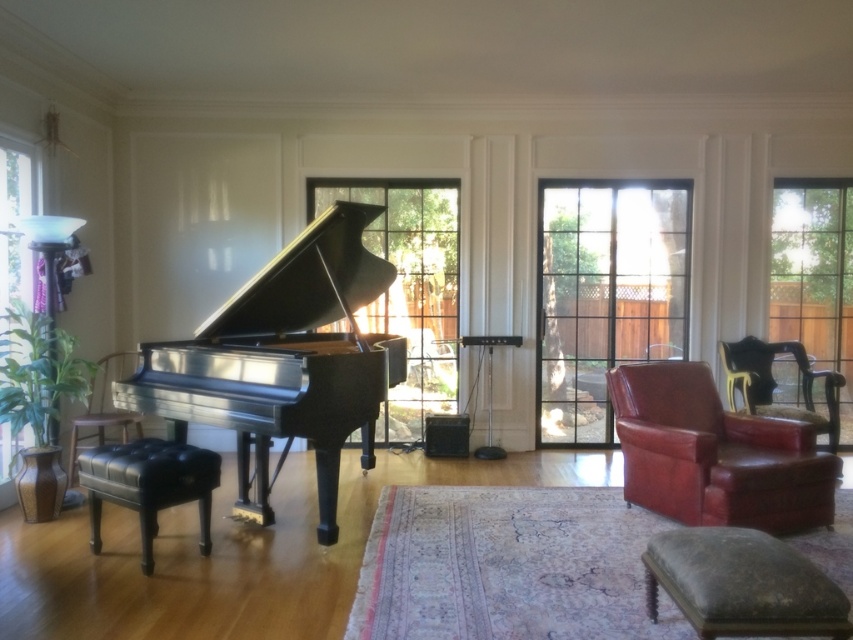
Question: Is dark brown leather ottoman at lower right positioned before leather armchair at right?

Choices:
 (A) no
 (B) yes

Answer: (B)

Question: Can you confirm if matte leather armchair at right is positioned to the right of dark brown leather ottoman at lower right?

Choices:
 (A) yes
 (B) no

Answer: (A)

Question: Estimate the real-world distances between objects in this image. Which object is farther from the leather armchair at left?

Choices:
 (A) dark brown leather ottoman at lower right
 (B) clear glass window at center

Answer: (A)

Question: Based on their relative distances, which object is farther from the leather armchair at right?

Choices:
 (A) dark brown leather ottoman at lower right
 (B) leather armchair at left
 (C) clear glass window at right

Answer: (B)

Question: Among these points, which one is farthest from the camera?

Choices:
 (A) (73, 433)
 (B) (819, 417)

Answer: (B)

Question: Can you confirm if black leather stool at lower left is positioned to the right of leather armchair at left?

Choices:
 (A) yes
 (B) no

Answer: (A)